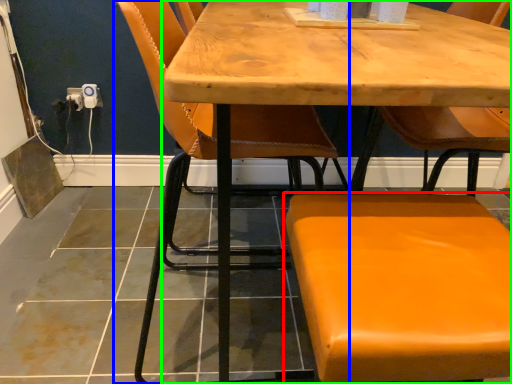
Question: Which object is the closest to the chair (highlighted by a red box)? Choose among these: chair (highlighted by a blue box) or table (highlighted by a green box).

Choices:
 (A) chair
 (B) table

Answer: (B)